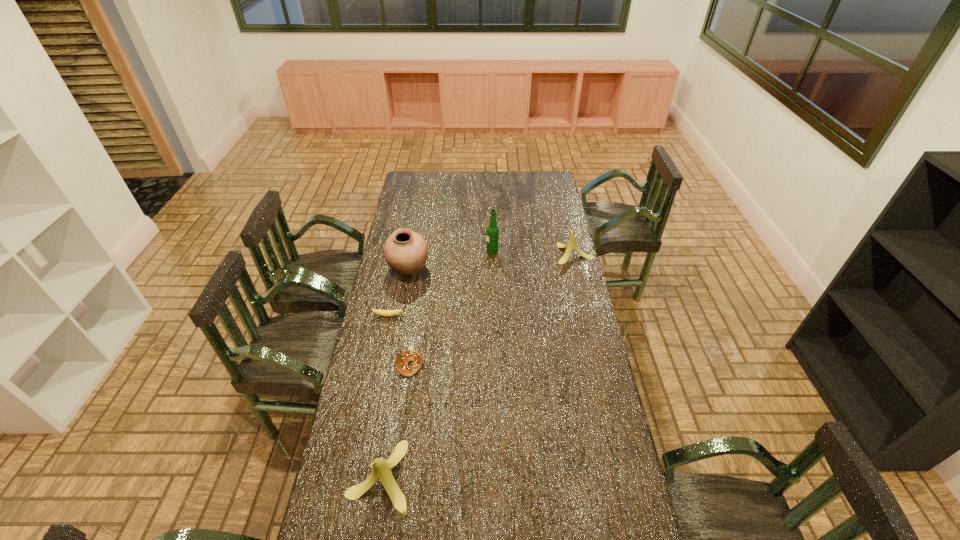
Where is `bagel at the left edge`? The width and height of the screenshot is (960, 540). bagel at the left edge is located at coordinates (404, 358).

Find the location of `object that is positioned at the right edge`. object that is positioned at the right edge is located at coordinates (572, 243).

This screenshot has height=540, width=960. I want to click on object at the near left corner, so click(x=381, y=470).

Image resolution: width=960 pixels, height=540 pixels. Identify the location of vacant space at the far edge. (458, 187).

Locate an element on the screen. The image size is (960, 540). vacant space at the left edge of the desktop is located at coordinates (413, 207).

The width and height of the screenshot is (960, 540). I want to click on vacant position at the right edge of the desktop, so click(607, 495).

Identify the location of free point between the beer bottle and the fourth tallest object. This screenshot has height=540, width=960. (533, 253).

I want to click on free spot between the nearest object and the rightmost banana, so click(x=477, y=365).

Locate an element on the screen. Image resolution: width=960 pixels, height=540 pixels. free space between the farthest banana and the second shortest object is located at coordinates (481, 285).

Identify the location of vacant area between the pottery and the fifth farthest object. Image resolution: width=960 pixels, height=540 pixels. click(x=409, y=316).